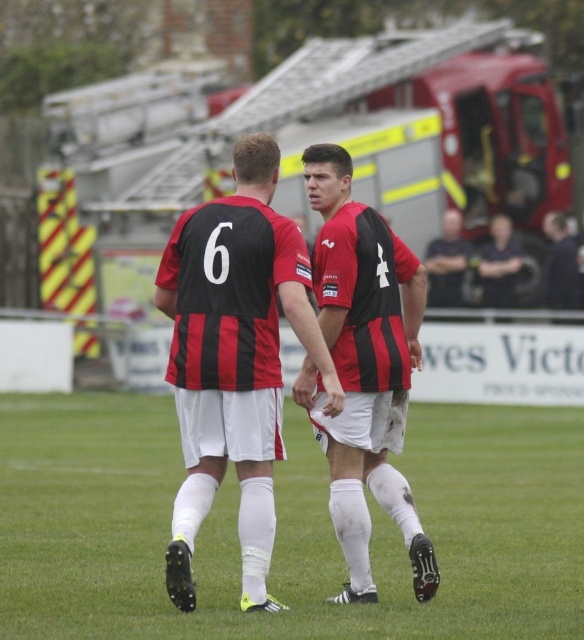
Question: Considering the relative positions of green grass at center and red metallic fire truck at upper center in the image provided, where is green grass at center located with respect to red metallic fire truck at upper center?

Choices:
 (A) below
 (B) above

Answer: (A)

Question: Which point appears farthest from the camera in this image?

Choices:
 (A) (418, 541)
 (B) (507, 285)
 (C) (408, 132)

Answer: (C)

Question: Estimate the real-world distances between objects in this image. Which object is closer to the dark blue jersey at center?

Choices:
 (A) dark gray shirt at center
 (B) red metallic fire truck at upper center

Answer: (A)

Question: Which object appears farthest from the camera in this image?

Choices:
 (A) matte red and black jersey at center
 (B) matte black jersey at center
 (C) red metallic fire truck at upper center
 (D) dark gray shirt at center

Answer: (D)

Question: Is green grass at center positioned before red metallic fire truck at upper center?

Choices:
 (A) yes
 (B) no

Answer: (A)

Question: From the image, what is the correct spatial relationship of matte black jersey at center in relation to dark blue jersey at center?

Choices:
 (A) left
 (B) right

Answer: (A)